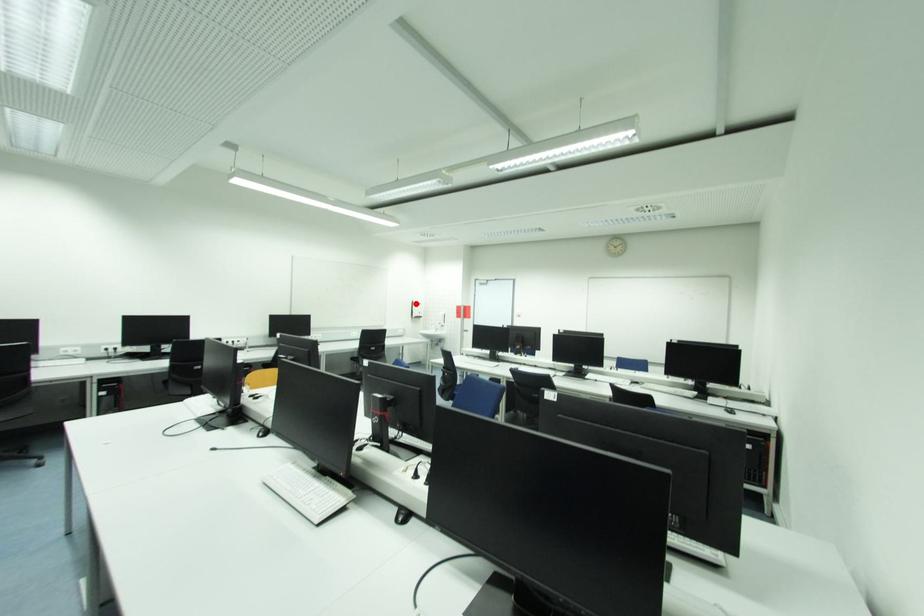
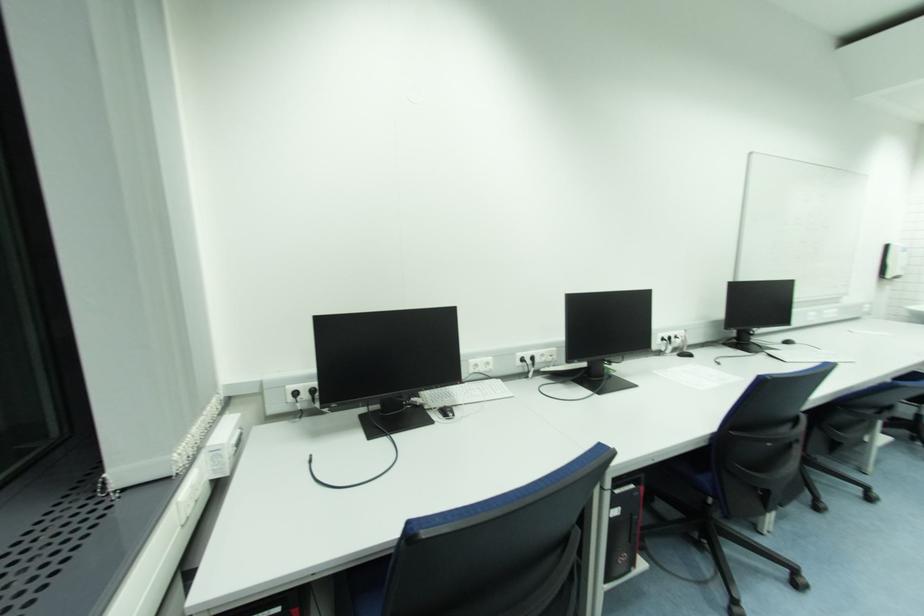
Question: I am providing you with two images of the same scene from different viewpoints. Given a red point in image1, look at the same physical point in image2. Is it:

Choices:
 (A) Closer to the viewpoint
 (B) Farther from the viewpoint

Answer: (B)